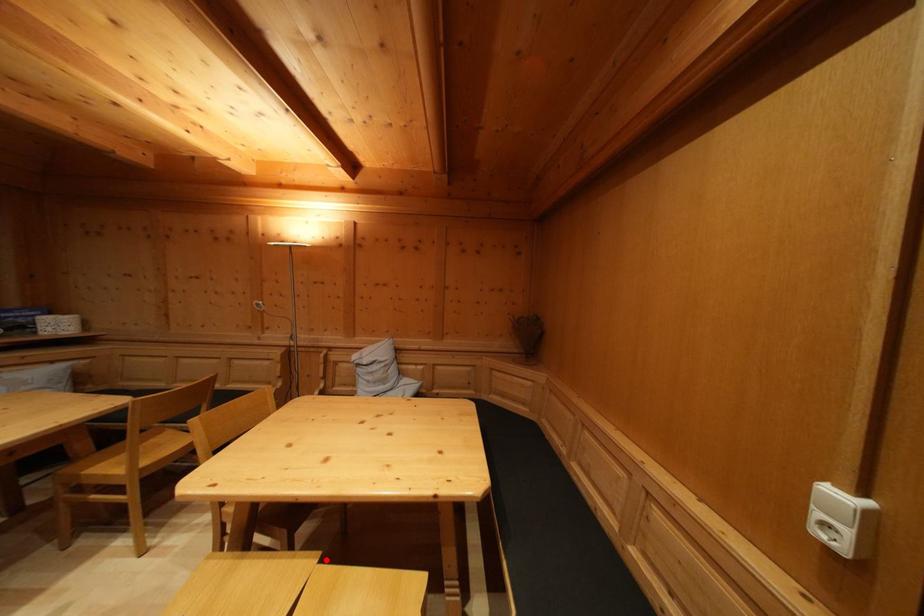
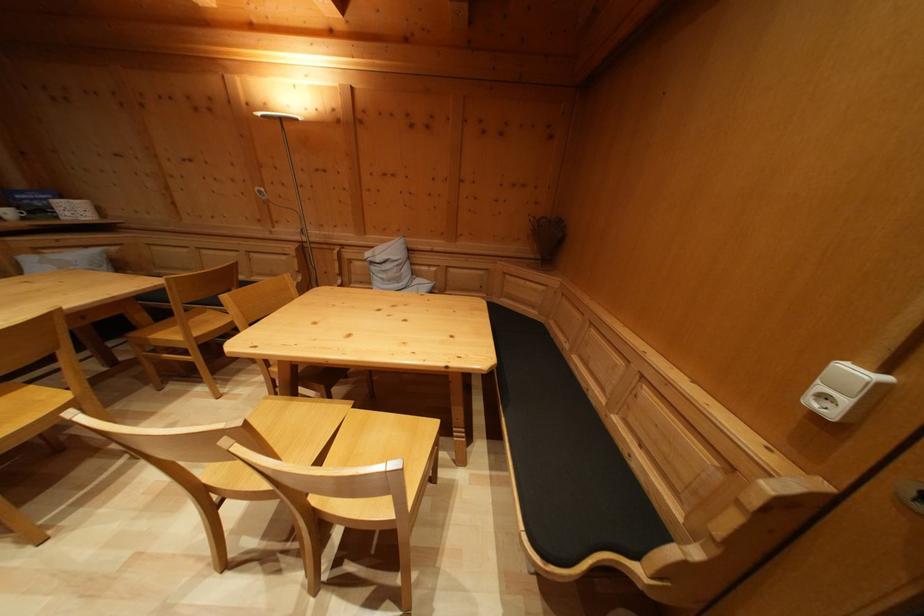
Question: I am providing you with two images of the same scene from different viewpoints. A red point is shown in image1. For the corresponding object point in image2, is it positioned nearer or farther from the camera?

Choices:
 (A) Nearer
 (B) Farther

Answer: (A)